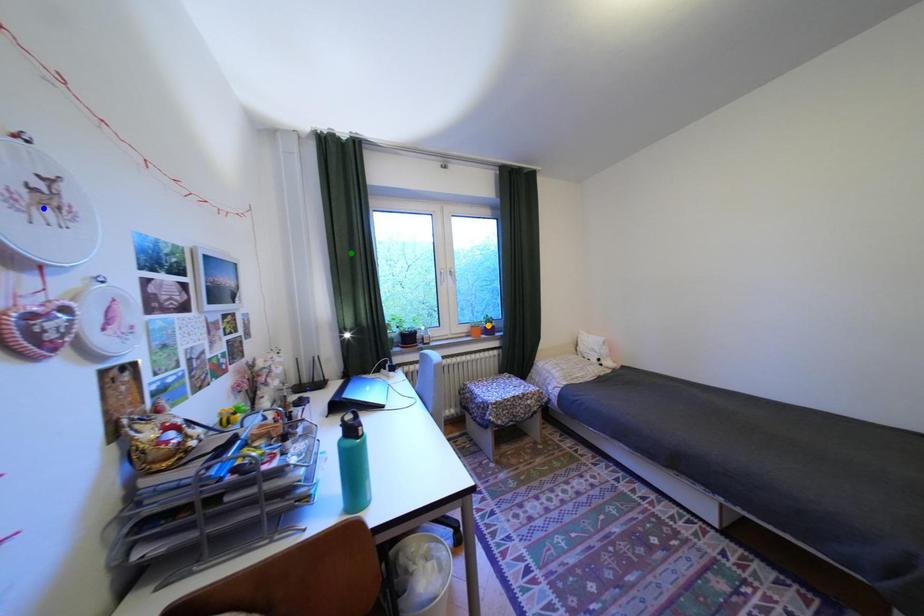
Order these from nearest to farthest:
- orange point
- blue point
- green point

1. blue point
2. green point
3. orange point